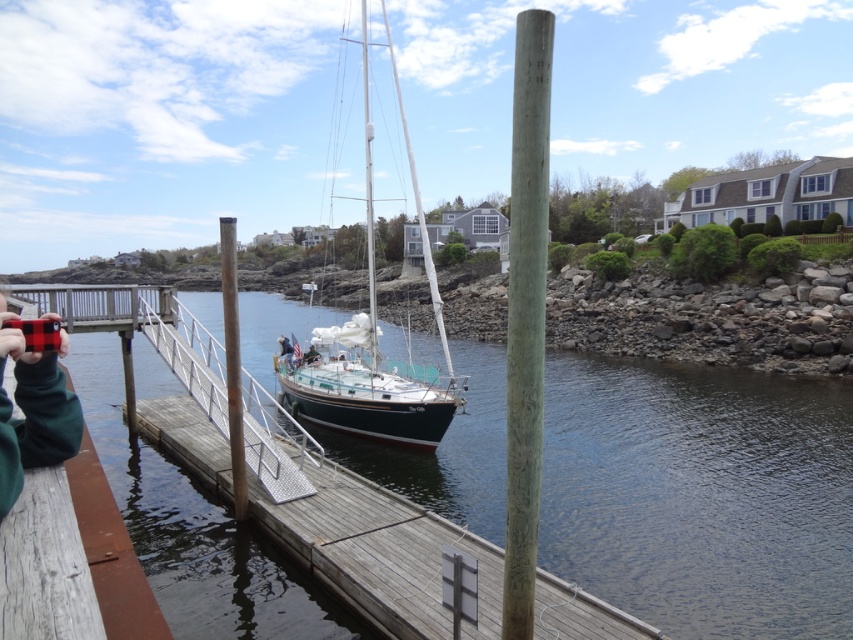
Is shiny dark blue sailboat at center positioned before rustic wood post at center?

No, shiny dark blue sailboat at center is behind rustic wood post at center.

Who is more forward, [351,420] or [236,516]?

Point [236,516] is more forward.

Locate an element on the screen. Image resolution: width=853 pixels, height=640 pixels. shiny dark blue sailboat at center is located at coordinates point(374,340).

Does smooth dark water at center have a smaller size compared to green wood pole at center?

No.

Which of these two, smooth dark water at center or green wood pole at center, stands shorter?

Standing shorter between the two is smooth dark water at center.

Find the location of a particular element. smooth dark water at center is located at coordinates (700, 496).

Who is more distant from viewer, [238,621] or [287,356]?

Positioned behind is point [287,356].

In the scene shown: Can you confirm if smooth dark water at center is taller than white fabric person at center?

Correct, smooth dark water at center is much taller as white fabric person at center.

In order to click on smooth dark water at center in this screenshot , I will do `click(700, 496)`.

Identify the location of smooth dark water at center. The height and width of the screenshot is (640, 853). (700, 496).